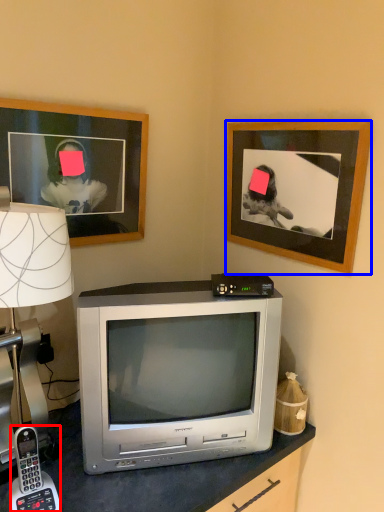
Question: Which of the following is the farthest to the observer, corded phone (highlighted by a red box) or picture frame (highlighted by a blue box)?

Choices:
 (A) corded phone
 (B) picture frame

Answer: (B)